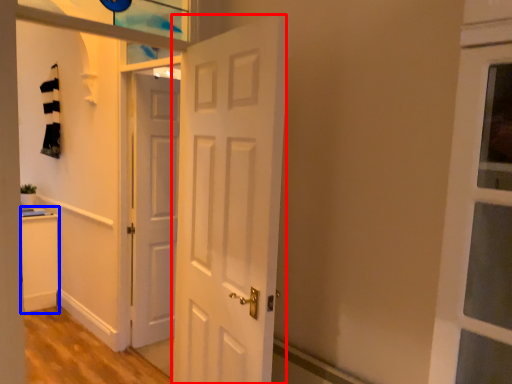
Question: Which object appears farthest to the camera in this image, door (highlighted by a red box) or cabinetry (highlighted by a blue box)?

Choices:
 (A) door
 (B) cabinetry

Answer: (B)